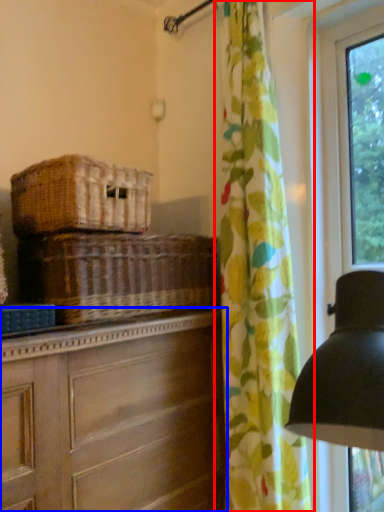
Question: Among these objects, which one is farthest to the camera, curtain (highlighted by a red box) or chest of drawers (highlighted by a blue box)?

Choices:
 (A) curtain
 (B) chest of drawers

Answer: (A)